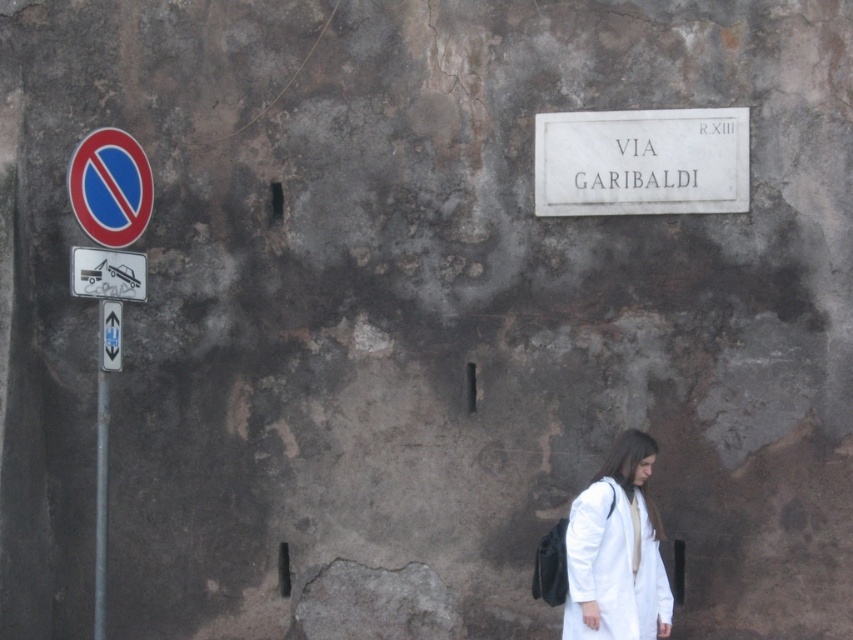
Does point (669, 184) come farther from viewer compared to point (579, 637)?

Yes, it is behind point (579, 637).

What do you see at coordinates (641, 161) in the screenshot? I see `white marble sign at upper center` at bounding box center [641, 161].

Describe the element at coordinates (641, 161) in the screenshot. I see `white marble sign at upper center` at that location.

I want to click on white marble sign at upper center, so click(641, 161).

How far apart are white fabric coat at lower right and smooth plastic circle at left?

white fabric coat at lower right and smooth plastic circle at left are 2.25 meters apart from each other.

Who is more forward, (627, 488) or (74, 179)?

Point (74, 179)

Identify the location of white fabric coat at lower right. The image size is (853, 640). (618, 550).

Who is higher up, white marble sign at upper center or white plastic tow truck at left?

white marble sign at upper center is above.

Between point (563, 157) and point (97, 282), which one is positioned behind?

Point (563, 157)

Measure the distance between white marble sign at upper center and camera.

33.69 feet

Where is `white marble sign at upper center`? This screenshot has width=853, height=640. white marble sign at upper center is located at coordinates click(x=641, y=161).